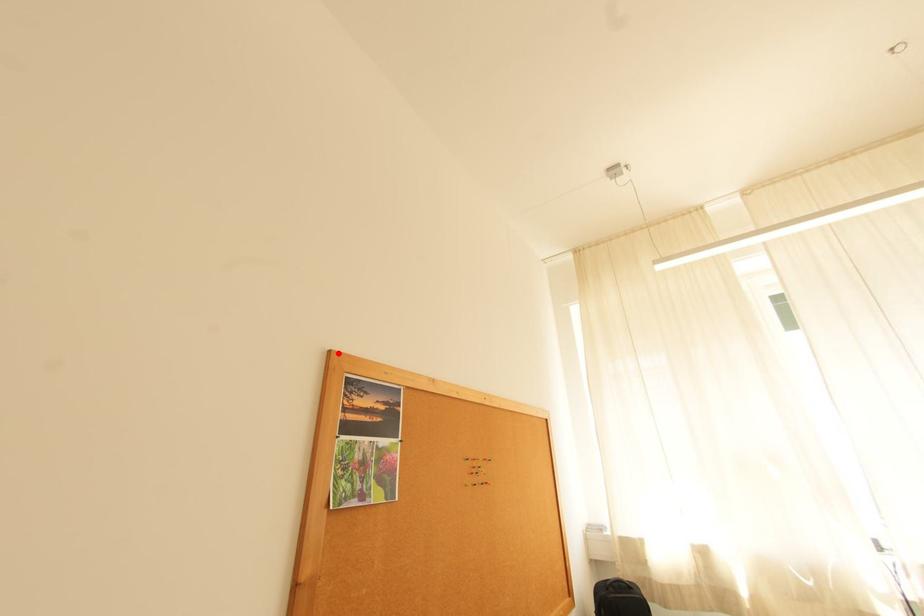
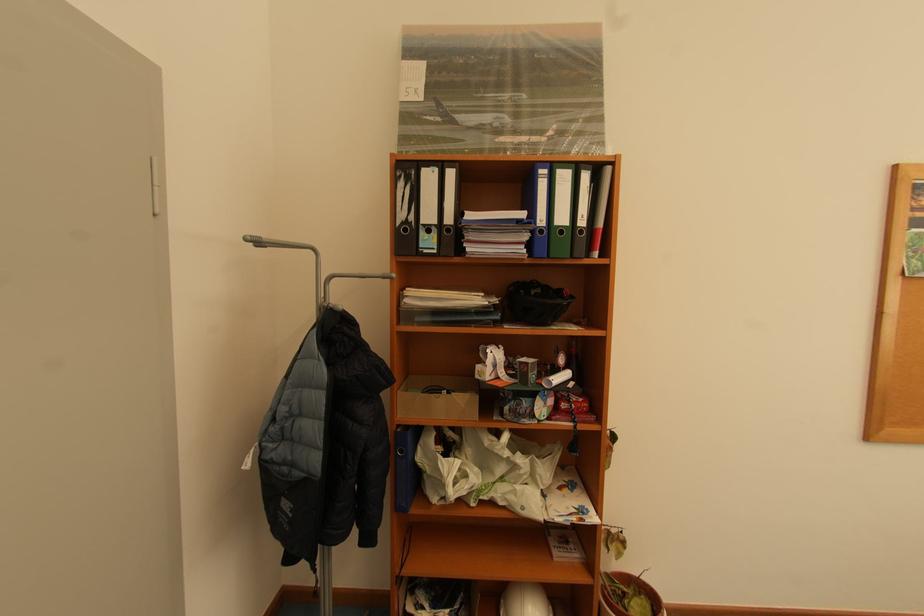
Where in the second image is the point corresponding to the highlighted location from the first image?

(904, 167)